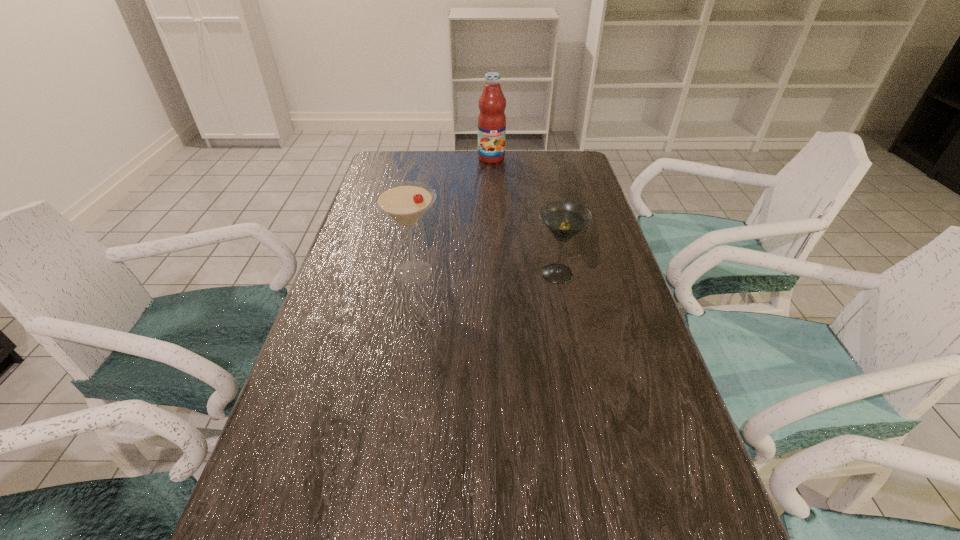
Locate an element on the screen. This screenshot has width=960, height=540. free space at the left edge of the desktop is located at coordinates (299, 461).

Locate an element on the screen. vacant area at the right edge is located at coordinates (582, 194).

This screenshot has height=540, width=960. Identify the location of free space at the far left corner of the desktop. [x=396, y=177].

Locate an element on the screen. Image resolution: width=960 pixels, height=540 pixels. vacant space that's between the leftmost object and the fruit juice is located at coordinates 452,215.

The height and width of the screenshot is (540, 960). I want to click on unoccupied area between the right martini and the left martini, so click(x=486, y=273).

Find the location of `vacant point located between the rightmost object and the leftmost object`. vacant point located between the rightmost object and the leftmost object is located at coordinates (486, 273).

Identify the location of unoccupied area between the farthest object and the leftmost object. (452, 215).

Where is `free spot between the farthest object and the right martini`? free spot between the farthest object and the right martini is located at coordinates (524, 216).

Where is `the closest object to the right martini`? Image resolution: width=960 pixels, height=540 pixels. the closest object to the right martini is located at coordinates (405, 202).

Identify the location of object that stands as the second closest to the left martini. This screenshot has width=960, height=540. [x=491, y=120].